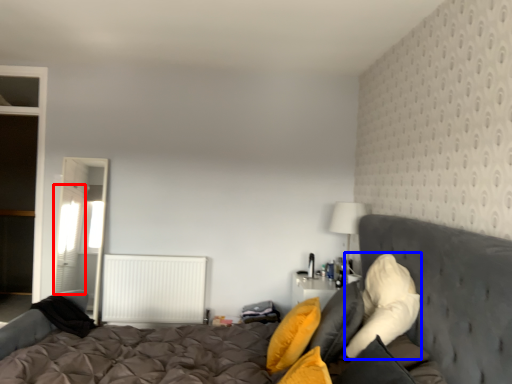
Question: Which object appears closest to the camera in this image, curtain (highlighted by a red box) or pillow (highlighted by a blue box)?

Choices:
 (A) curtain
 (B) pillow

Answer: (B)